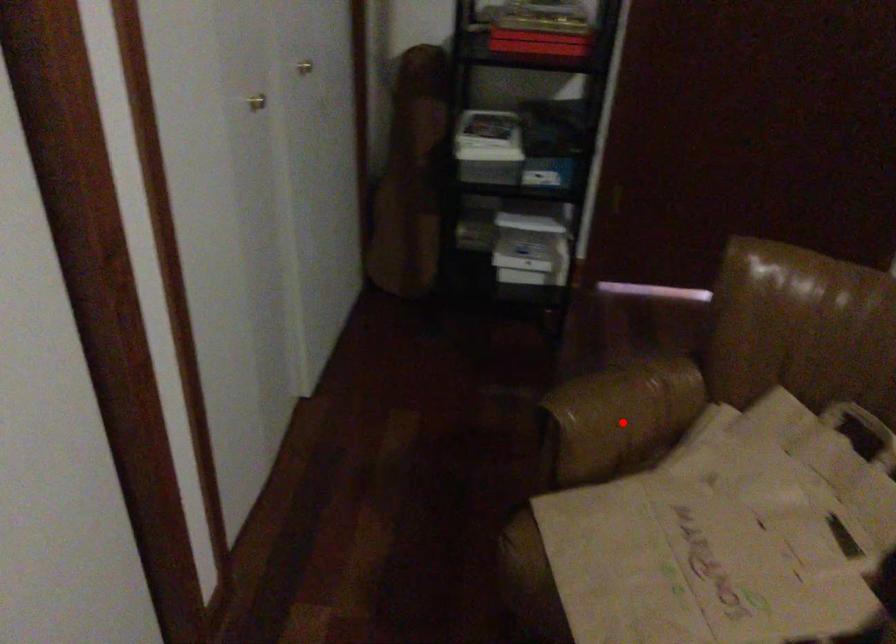
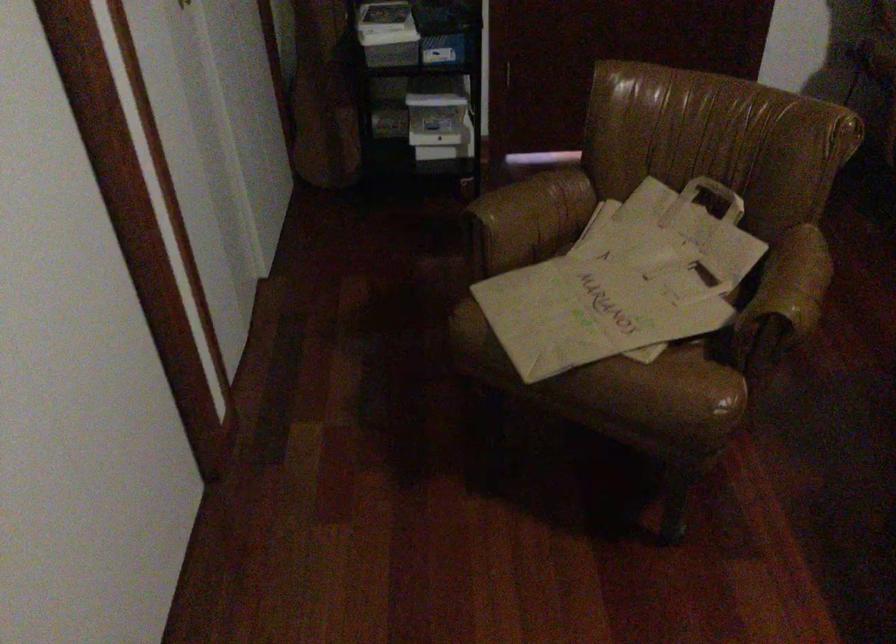
In the second image, find the point that corresponds to the highlighted location in the first image.

(532, 216)